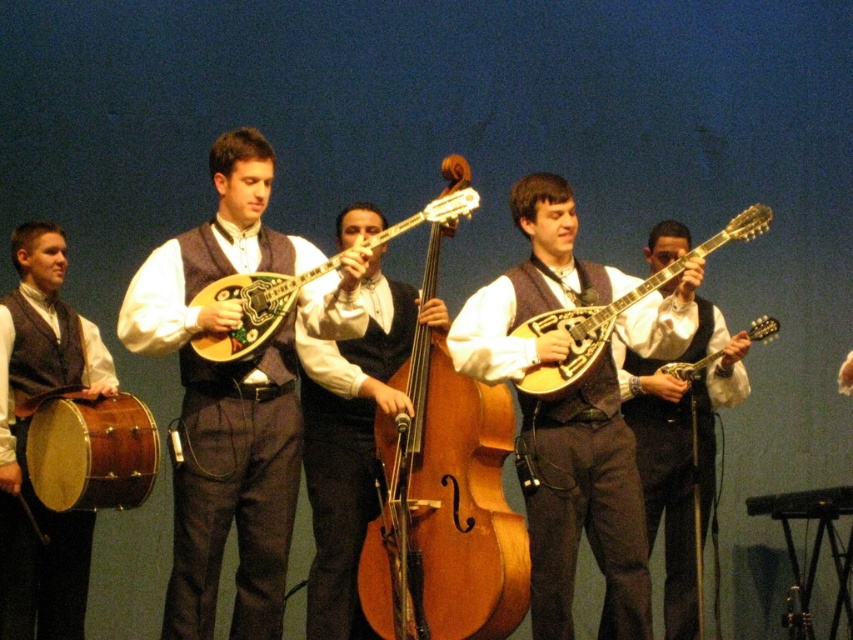
Question: Which object is the closest to the matte brown drum at left?

Choices:
 (A) matte brown mandolin at center
 (B) matte brown guitar at center
 (C) wooden bass at center

Answer: (C)

Question: Which of the following is the closest to the observer?

Choices:
 (A) wooden bass at center
 (B) matte wood banjo at center

Answer: (B)

Question: Can you confirm if matte wood mandolin at center is positioned above matte wood banjo at center?

Choices:
 (A) yes
 (B) no

Answer: (B)

Question: Where is matte wood banjo at center located in relation to matte brown banjo at center in the image?

Choices:
 (A) left
 (B) right

Answer: (A)

Question: Among these objects, which one is nearest to the camera?

Choices:
 (A) matte wood mandolin at center
 (B) matte brown banjo at center
 (C) wooden bass at center
 (D) matte brown guitar at center

Answer: (B)

Question: Is matte wood mandolin at center positioned before light brown wooden cello at center?

Choices:
 (A) no
 (B) yes

Answer: (B)